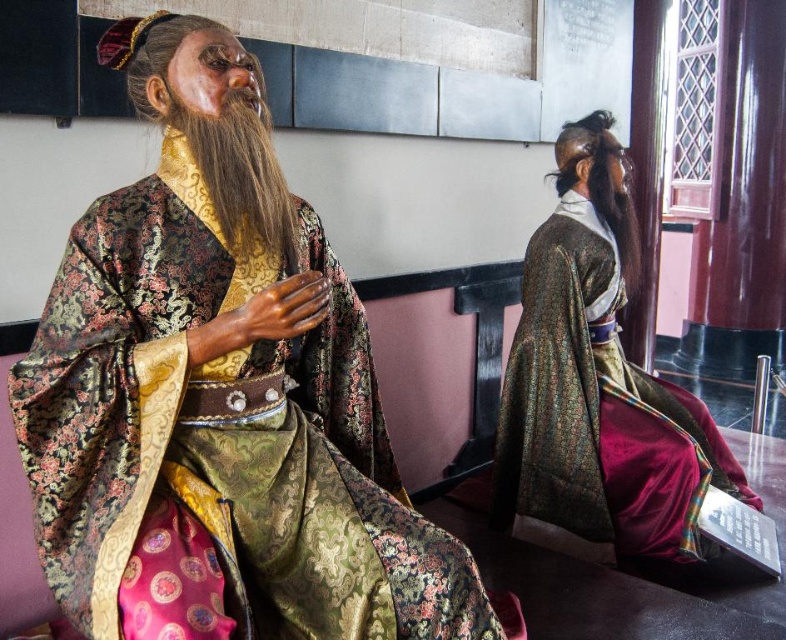
Can you confirm if velvet-like green robe at right is positioned to the left of brown silky beard at center?

No, velvet-like green robe at right is not to the left of brown silky beard at center.

Is velvet-like green robe at right above brown silky beard at center?

Actually, velvet-like green robe at right is below brown silky beard at center.

Where is `velvet-like green robe at right`? The height and width of the screenshot is (640, 786). velvet-like green robe at right is located at coordinates (597, 410).

Can you confirm if gold brocade robe at center is taller than velvet-like green robe at right?

In fact, gold brocade robe at center may be shorter than velvet-like green robe at right.

Does gold brocade robe at center have a greater width compared to velvet-like green robe at right?

No.

Where is `gold brocade robe at center`? The image size is (786, 640). gold brocade robe at center is located at coordinates (222, 435).

Describe the element at coordinates (222, 435) in the screenshot. I see `gold brocade robe at center` at that location.

Can you confirm if gold brocade robe at center is taller than brown silky beard at center?

Yes, gold brocade robe at center is taller than brown silky beard at center.

What do you see at coordinates (222, 435) in the screenshot? I see `gold brocade robe at center` at bounding box center [222, 435].

Identify the location of gold brocade robe at center. [222, 435].